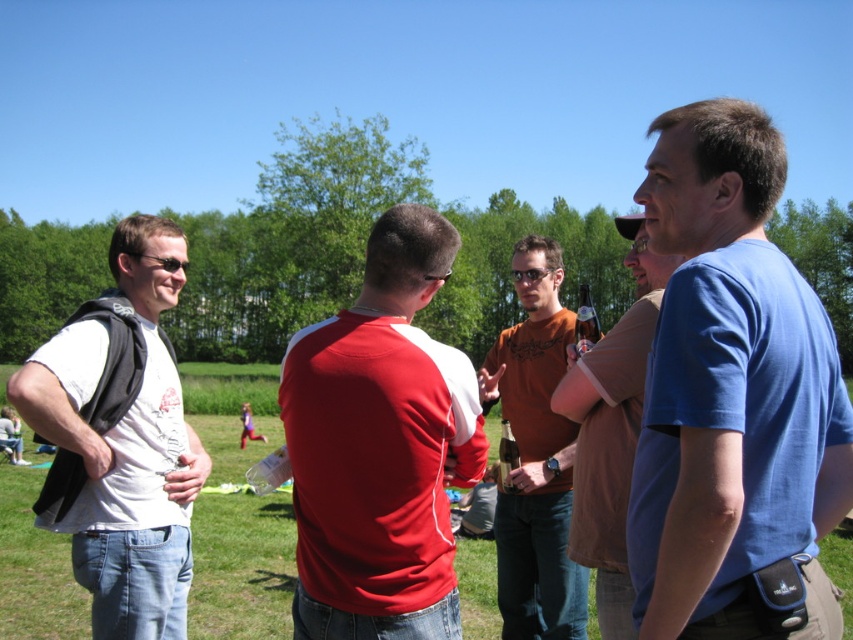
Is matte red shirt at center behind white matte t-shirt at left?

No, it is in front of white matte t-shirt at left.

Measure the distance between point (314, 404) and camera.

Point (314, 404) and camera are 2.49 meters apart from each other.

Measure the distance between matte red shirt at center and camera.

A distance of 8.01 feet exists between matte red shirt at center and camera.

You are a GUI agent. You are given a task and a screenshot of the screen. Output one action in this format:
    pyautogui.click(x=<x>, y=<y>)
    Task: Click on the matte red shirt at center
    The width and height of the screenshot is (853, 640).
    Given the screenshot: What is the action you would take?
    pyautogui.click(x=380, y=445)

Is point (386, 289) more distant than point (656, 273)?

No.

Is point (317, 374) less distant than point (596, 504)?

Yes, point (317, 374) is in front of point (596, 504).

Identify the location of matte red shirt at center. The image size is (853, 640). (380, 445).

Who is positioned more to the left, white matte t-shirt at left or brown cotton t-shirt at center?

Positioned to the left is white matte t-shirt at left.

Between point (103, 358) and point (633, 310), which one is positioned in front?

Point (633, 310)

Where is `white matte t-shirt at left`? white matte t-shirt at left is located at coordinates (125, 445).